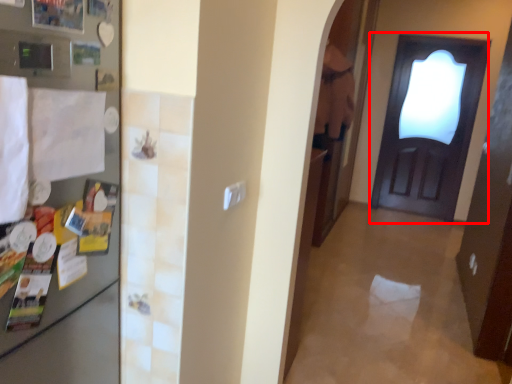
Question: From the image's perspective, where is door (annotated by the red box) located in relation to fridge in the image?

Choices:
 (A) above
 (B) below

Answer: (A)